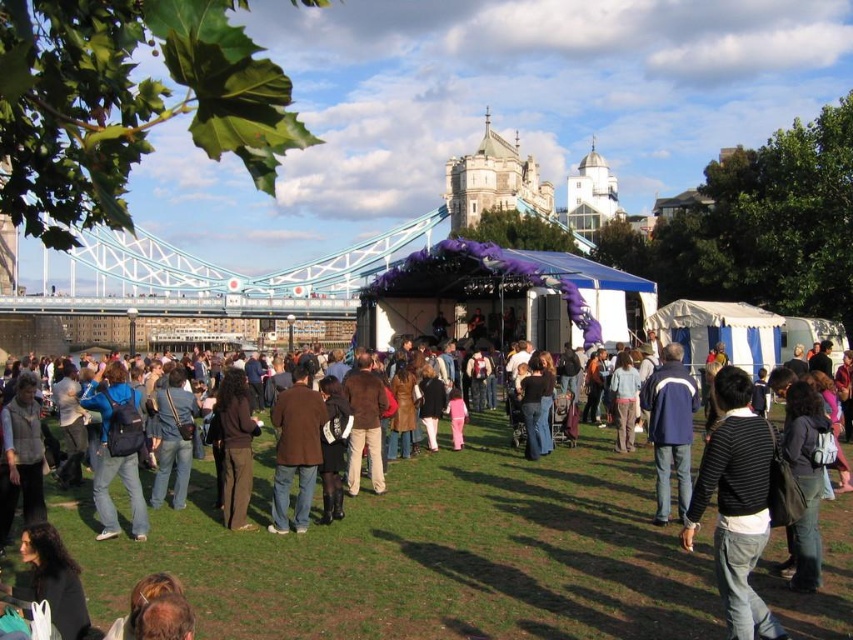
You are a photographer positioned at the edge of the crowd, aiming to capture a photo of the denim jacket at left and the dark brown pants at center. Based on their positions, which object should you adjust your camera to focus on first if you want to include both in the frame without moving your position?

The denim jacket at left should be focused on first since it is positioned to the left of the dark brown pants at center, allowing the photographer to frame both by starting with the leftmost object.

You are a photographer trying to capture a clear shot of the stage from the green grass at center. However, there is a brown leather jacket at center in your way. Based on their positions, can you still take the photo without moving the jacket?

The green grass at center is positioned under the brown leather jacket at center, meaning the jacket is above the grass. Since the jacket is blocking the direct line of sight to the stage, you cannot take a clear photo without moving the jacket.

You are a photographer at the event and want to capture both the denim jacket at left and the dark brown pants at center in a single photo. Based on their positions, where should you aim the camera to include both?

To include both the denim jacket at left and the dark brown pants at center in the photo, aim the camera at the dark brown pants at center since the denim jacket at left is positioned below it, ensuring both are within the frame.